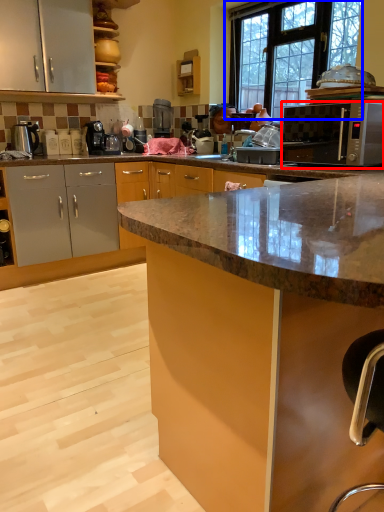
Question: Which object is further to the camera taking this photo, microwave oven (highlighted by a red box) or window (highlighted by a blue box)?

Choices:
 (A) microwave oven
 (B) window

Answer: (B)